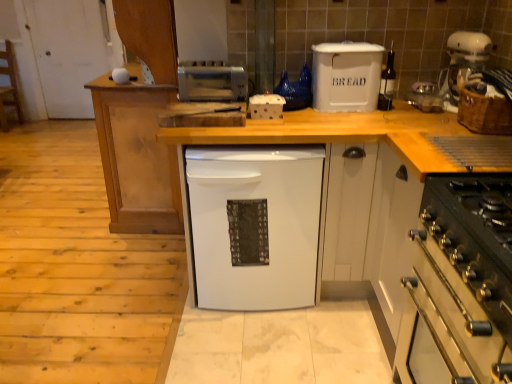
Question: Is clear plastic container at upper right, which is the first appliance in right-to-left order, bigger than satin silver toaster at upper center, acting as the first appliance starting from the left?

Choices:
 (A) no
 (B) yes

Answer: (A)

Question: Does clear plastic container at upper right, the 4th appliance viewed from the left, turn towards satin silver toaster at upper center, which is counted as the fourth appliance, starting from the right?

Choices:
 (A) yes
 (B) no

Answer: (B)

Question: Can you confirm if clear plastic container at upper right, the 4th appliance viewed from the left, is thinner than satin silver toaster at upper center, which is counted as the fourth appliance, starting from the right?

Choices:
 (A) yes
 (B) no

Answer: (B)

Question: Is the position of clear plastic container at upper right, the 4th appliance viewed from the left, more distant than that of satin silver toaster at upper center, acting as the first appliance starting from the left?

Choices:
 (A) yes
 (B) no

Answer: (A)

Question: Is clear plastic container at upper right, the 4th appliance viewed from the left, looking in the opposite direction of satin silver toaster at upper center, which is counted as the fourth appliance, starting from the right?

Choices:
 (A) yes
 (B) no

Answer: (B)

Question: Considering the positions of matte white wine bottle at center, acting as the 3th appliance starting from the left, and white matte dishwasher at center in the image, is matte white wine bottle at center, acting as the 3th appliance starting from the left, taller or shorter than white matte dishwasher at center?

Choices:
 (A) tall
 (B) short

Answer: (B)

Question: In the image, is matte white wine bottle at center, the second appliance when ordered from right to left, on the left side or the right side of white matte dishwasher at center?

Choices:
 (A) right
 (B) left

Answer: (A)

Question: Considering the positions of matte white wine bottle at center, acting as the 3th appliance starting from the left, and white matte dishwasher at center in the image, is matte white wine bottle at center, acting as the 3th appliance starting from the left, wider or thinner than white matte dishwasher at center?

Choices:
 (A) wide
 (B) thin

Answer: (B)

Question: From a real-world perspective, relative to white matte dishwasher at center, is matte white wine bottle at center, the second appliance when ordered from right to left, vertically above or below?

Choices:
 (A) above
 (B) below

Answer: (A)

Question: From the image's perspective, is white wood countertop at center located above or below clear plastic container at upper right, the 4th appliance viewed from the left?

Choices:
 (A) below
 (B) above

Answer: (A)

Question: Considering the positions of point (394, 115) and point (430, 92), is point (394, 115) closer or farther from the camera than point (430, 92)?

Choices:
 (A) farther
 (B) closer

Answer: (B)

Question: From a real-world perspective, relative to clear plastic container at upper right, the 4th appliance viewed from the left, is white wood countertop at center vertically above or below?

Choices:
 (A) below
 (B) above

Answer: (A)

Question: From their relative heights in the image, would you say white wood countertop at center is taller or shorter than clear plastic container at upper right, which is the first appliance in right-to-left order?

Choices:
 (A) tall
 (B) short

Answer: (A)

Question: Is woven brown basket at right bigger or smaller than white plastic container at center, positioned as the 3th appliance in right-to-left order?

Choices:
 (A) big
 (B) small

Answer: (A)

Question: Is woven brown basket at right in front of or behind white plastic container at center, which is counted as the second appliance, starting from the left, in the image?

Choices:
 (A) front
 (B) behind

Answer: (A)